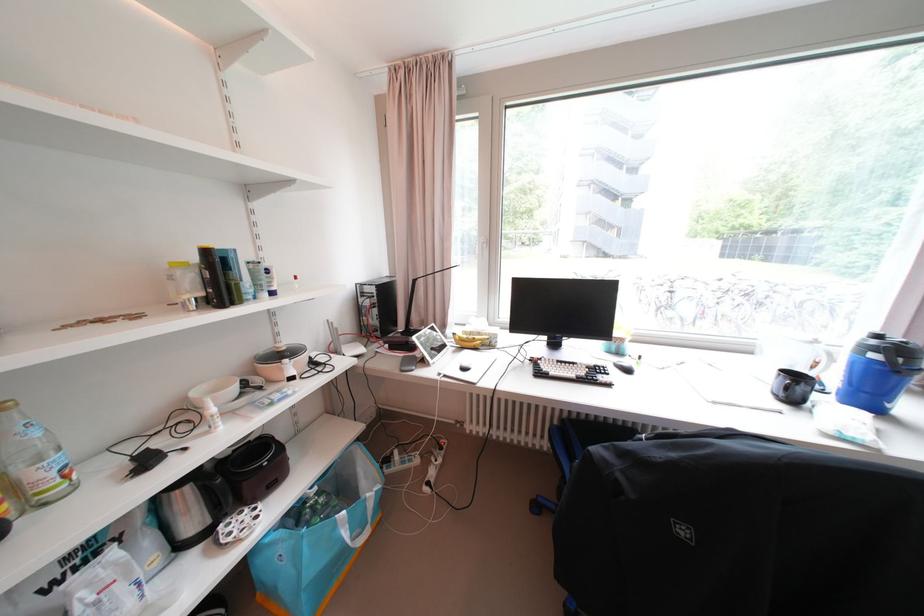
Where would you lift the blue bag handle? Please return your answer as a coordinate pair (x, y).

(357, 523)